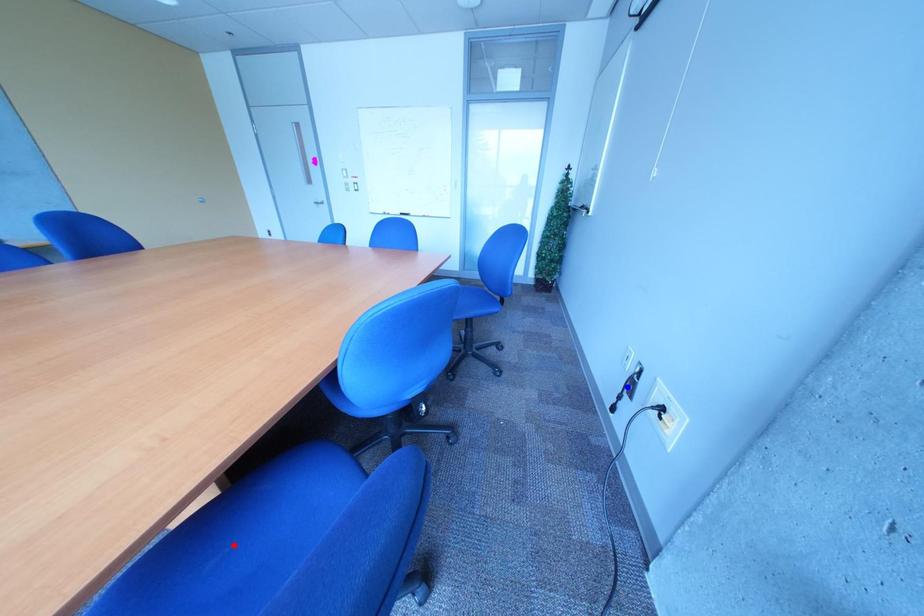
Question: Two points are marked on the image. Which point is closer to the camera?

Choices:
 (A) Blue point is closer.
 (B) Red point is closer.

Answer: (B)